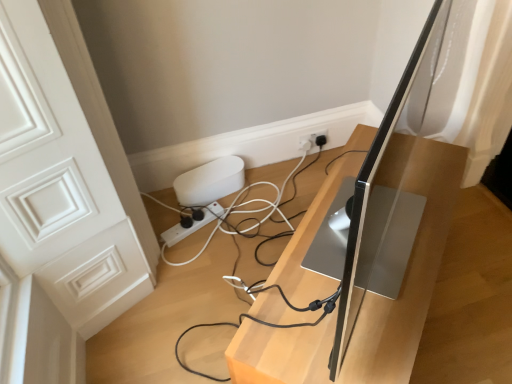
This screenshot has width=512, height=384. What are the coordinates of `vacant area that lies to the right of white plastic power strip at lower center` in the screenshot? It's located at (233, 229).